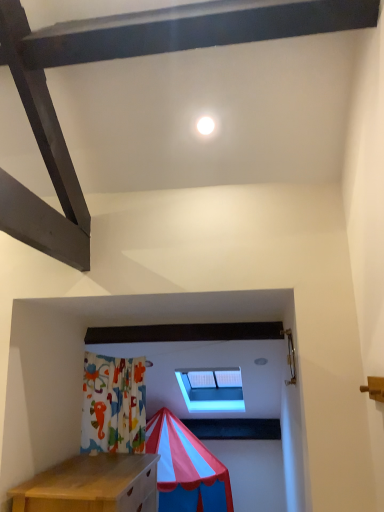
Question: Can you confirm if transparent plastic window at center is positioned to the right of white glossy light at upper center?

Choices:
 (A) yes
 (B) no

Answer: (A)

Question: Can you confirm if transparent plastic window at center is shorter than white glossy light at upper center?

Choices:
 (A) yes
 (B) no

Answer: (B)

Question: Is the depth of transparent plastic window at center less than that of white glossy light at upper center?

Choices:
 (A) yes
 (B) no

Answer: (B)

Question: Considering the relative sizes of transparent plastic window at center and white glossy light at upper center in the image provided, is transparent plastic window at center thinner than white glossy light at upper center?

Choices:
 (A) yes
 (B) no

Answer: (B)

Question: Does transparent plastic window at center appear on the left side of white glossy light at upper center?

Choices:
 (A) yes
 (B) no

Answer: (B)

Question: Is transparent plastic window at center oriented away from white glossy light at upper center?

Choices:
 (A) no
 (B) yes

Answer: (A)

Question: Is white glossy light at upper center positioned in front of transparent plastic window at center?

Choices:
 (A) yes
 (B) no

Answer: (A)

Question: Considering the relative positions of white glossy light at upper center and transparent plastic window at center in the image provided, is white glossy light at upper center to the right of transparent plastic window at center from the viewer's perspective?

Choices:
 (A) no
 (B) yes

Answer: (A)

Question: Considering the relative sizes of white glossy light at upper center and transparent plastic window at center in the image provided, is white glossy light at upper center bigger than transparent plastic window at center?

Choices:
 (A) yes
 (B) no

Answer: (B)

Question: From a real-world perspective, does white glossy light at upper center sit lower than transparent plastic window at center?

Choices:
 (A) no
 (B) yes

Answer: (A)

Question: Considering the relative sizes of white glossy light at upper center and transparent plastic window at center in the image provided, is white glossy light at upper center shorter than transparent plastic window at center?

Choices:
 (A) no
 (B) yes

Answer: (B)

Question: Is white glossy light at upper center thinner than transparent plastic window at center?

Choices:
 (A) yes
 (B) no

Answer: (A)

Question: Is white glossy light at upper center bigger or smaller than transparent plastic window at center?

Choices:
 (A) big
 (B) small

Answer: (B)